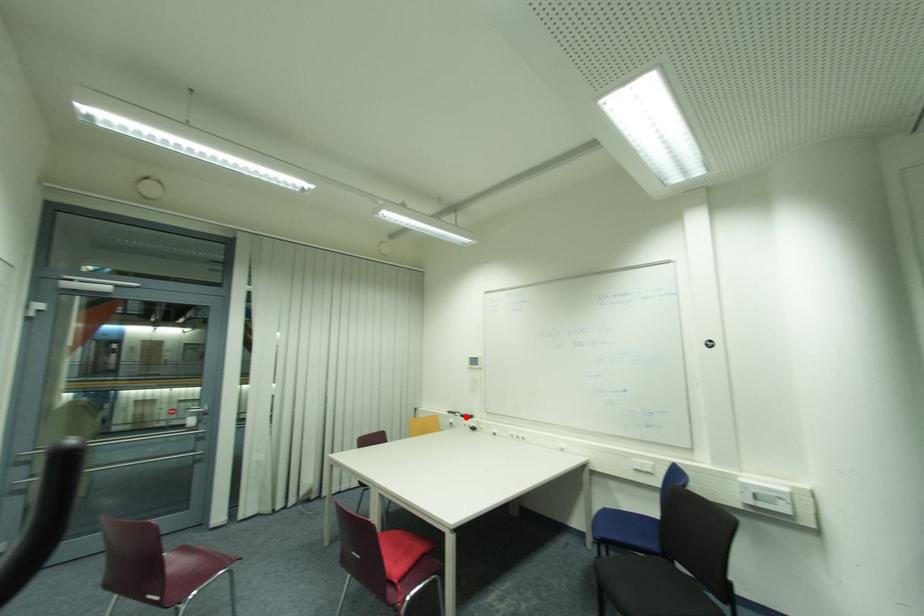
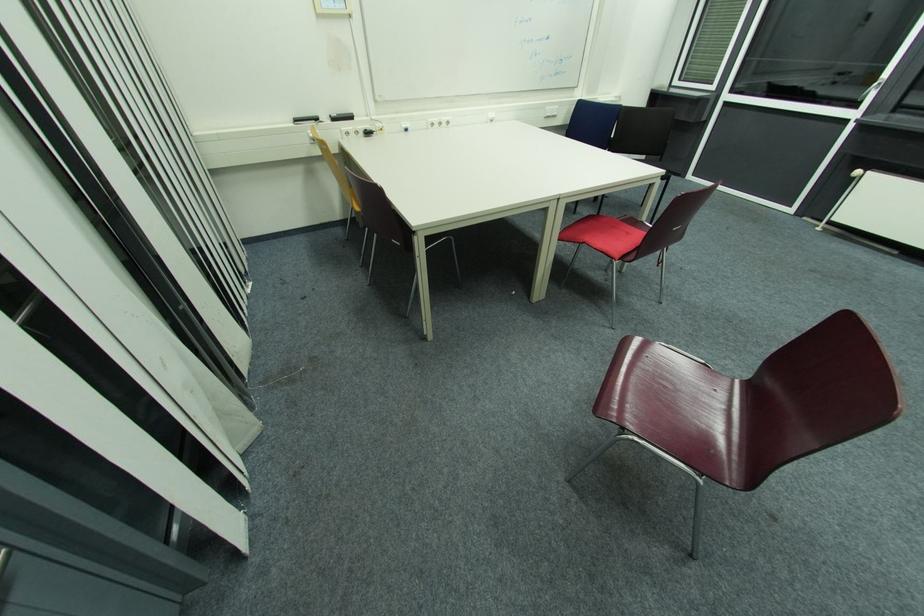
In the second image, find the point that corresponds to the highlighted location in the first image.

(337, 121)